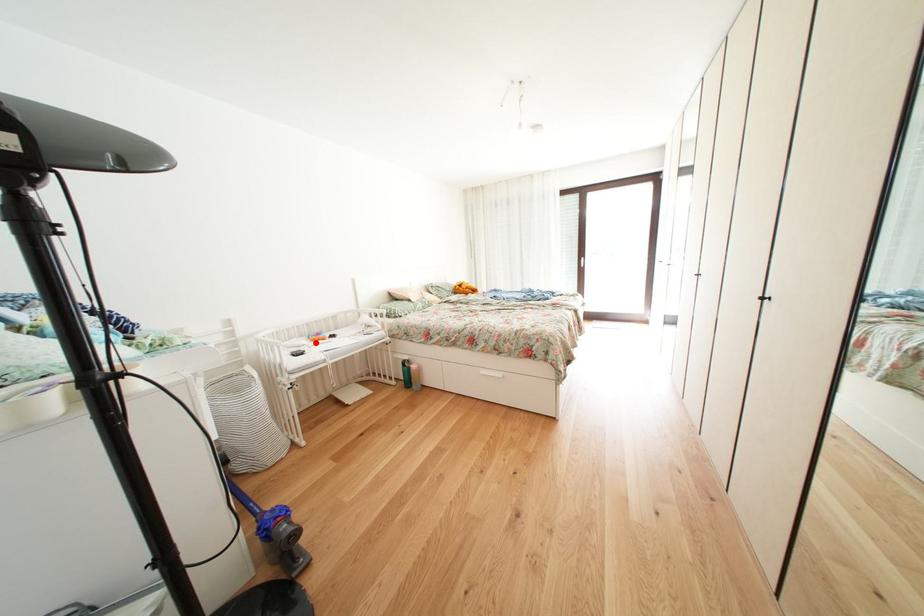
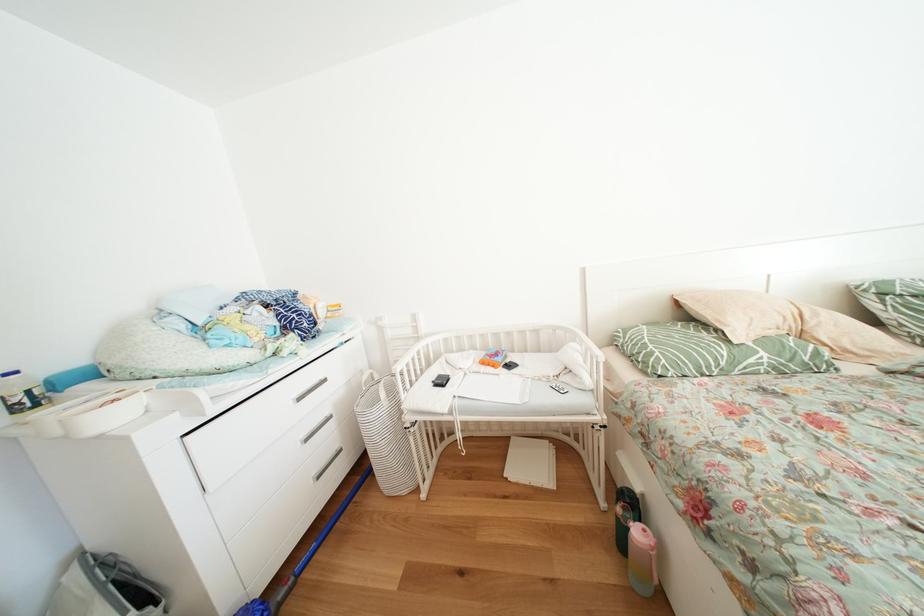
Where in the second image is the point corresponding to the highlighted location from the first image?

(491, 360)